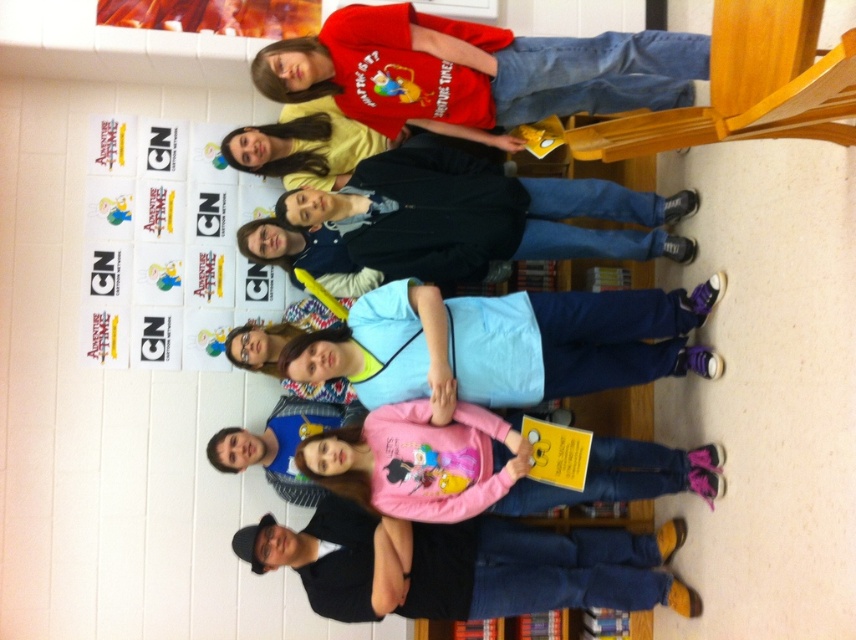
Question: Is matte black jacket at center closer to camera compared to pink cotton shirt at center?

Choices:
 (A) yes
 (B) no

Answer: (B)

Question: Which object appears closest to the camera in this image?

Choices:
 (A) pink cotton shirt at center
 (B) black matte shirt at lower center

Answer: (A)

Question: Is black matte shirt at lower center closer to the viewer compared to matte black jacket at center?

Choices:
 (A) no
 (B) yes

Answer: (B)

Question: Which object appears farthest from the camera in this image?

Choices:
 (A) black matte shirt at lower center
 (B) matte red t-shirt at upper center
 (C) matte black jacket at center
 (D) pink cotton shirt at center

Answer: (C)

Question: Which point appears farthest from the camera in this image?

Choices:
 (A) (418, 145)
 (B) (312, 68)
 (C) (443, 506)
 (D) (642, 596)

Answer: (A)

Question: Can you confirm if black matte shirt at lower center is positioned to the left of matte black jacket at center?

Choices:
 (A) yes
 (B) no

Answer: (A)